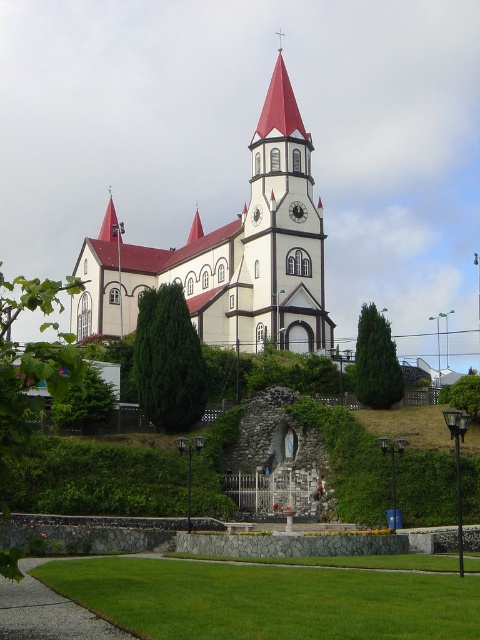
You are standing in front of the church and want to take a photo that includes both the white stone clock tower at center and the metallic clock face at center. Which object should you focus on first to ensure both are in frame?

You should focus on the white stone clock tower at center first because it is larger than the metallic clock face at center, ensuring it fits within the frame while still capturing the smaller clock face.

You are standing at the entrance of the church and want to locate the white stone clock tower at center. According to the coordinates provided, where should you look relative to your position?

The white stone clock tower at center is located at coordinates point (284, 227), which means it is positioned to the upper right of your current view from the entrance.

You are a tourist standing at the base of the hill looking up at the church. You notice the white stone clock tower at center and the smooth red spire at upper center. Which structure appears taller from your vantage point?

The white stone clock tower at center appears taller than the smooth red spire at upper center from your vantage point because the white stone clock tower at center has a greater height compared to the smooth red spire at upper center.